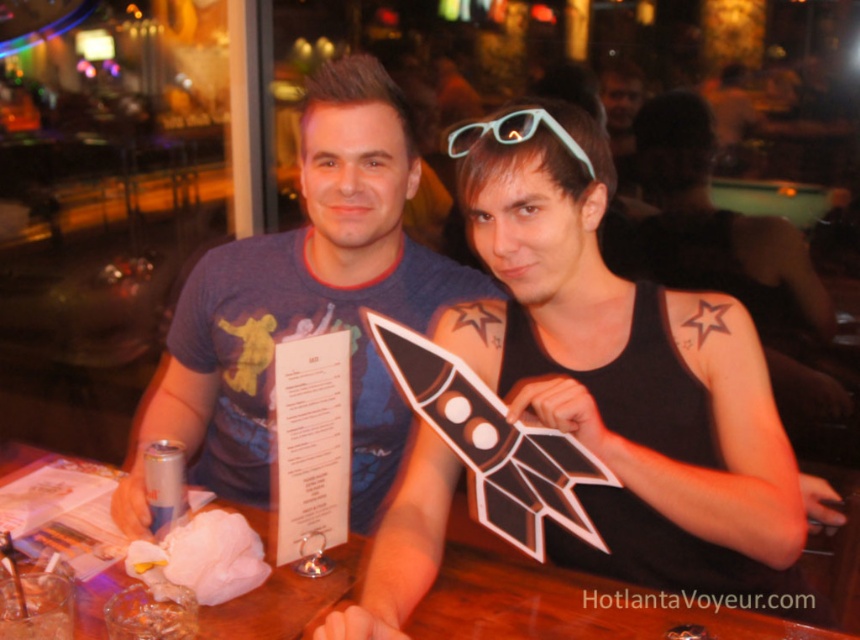
Measure the distance between blue cotton t-shirt at center and translucent plastic glasses at center.

The distance of blue cotton t-shirt at center from translucent plastic glasses at center is 39.63 centimeters.

Can you confirm if blue cotton t-shirt at center is smaller than translucent plastic glasses at center?

No.

Describe the element at coordinates (310, 298) in the screenshot. I see `blue cotton t-shirt at center` at that location.

You are a GUI agent. You are given a task and a screenshot of the screen. Output one action in this format:
    pyautogui.click(x=<x>, y=<y>)
    Task: Click on the blue cotton t-shirt at center
    This screenshot has width=860, height=640.
    Given the screenshot: What is the action you would take?
    [x=310, y=298]

The height and width of the screenshot is (640, 860). What do you see at coordinates (628, 376) in the screenshot? I see `matte blue t-shirt at center` at bounding box center [628, 376].

The width and height of the screenshot is (860, 640). Identify the location of matte blue t-shirt at center. point(628,376).

Which is more to the left, matte blue t-shirt at center or blue cotton t-shirt at center?

blue cotton t-shirt at center is more to the left.

Which of these two, matte blue t-shirt at center or blue cotton t-shirt at center, stands shorter?

Standing shorter between the two is matte blue t-shirt at center.

Locate an element on the screen. The height and width of the screenshot is (640, 860). matte blue t-shirt at center is located at coordinates (628, 376).